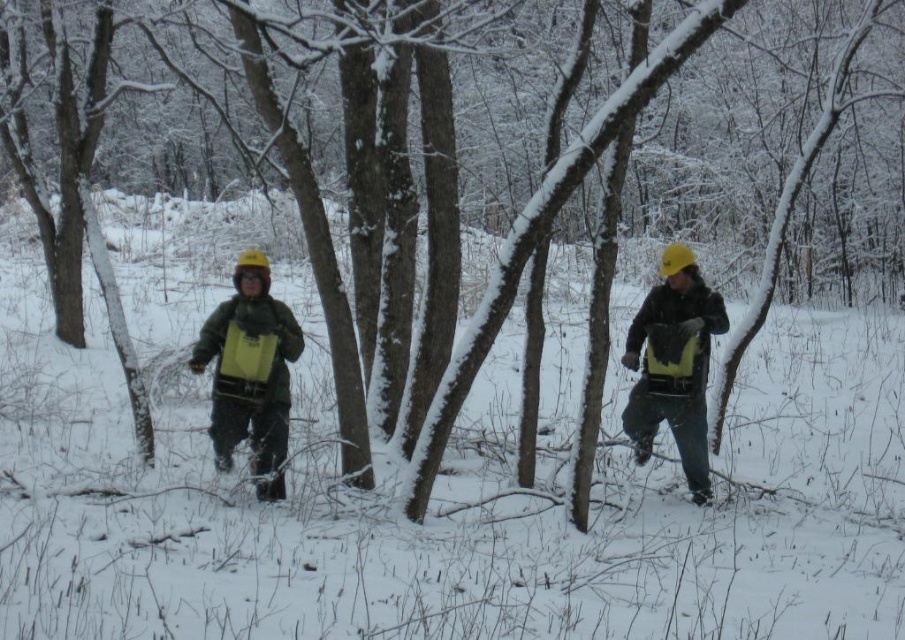
Question: Does matte green jacket at center have a greater width compared to yellow matte backpack at center?

Choices:
 (A) yes
 (B) no

Answer: (A)

Question: Which object appears farthest from the camera in this image?

Choices:
 (A) yellow matte backpack at center
 (B) matte green jacket at center

Answer: (A)

Question: Does matte green jacket at center have a greater width compared to yellow matte backpack at center?

Choices:
 (A) no
 (B) yes

Answer: (B)

Question: Is matte green jacket at center closer to the viewer compared to yellow matte backpack at center?

Choices:
 (A) no
 (B) yes

Answer: (B)

Question: Which object appears closest to the camera in this image?

Choices:
 (A) yellow matte backpack at center
 (B) matte green jacket at center

Answer: (B)

Question: Which of the following is the farthest from the observer?

Choices:
 (A) (233, 308)
 (B) (675, 440)

Answer: (B)